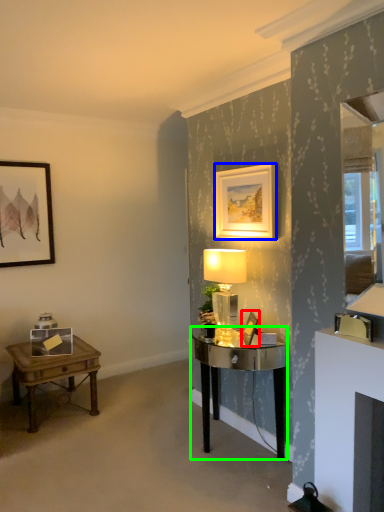
Question: Which object is the farthest from picture frame (highlighted by a red box)? Choose among these: picture frame (highlighted by a blue box) or desk (highlighted by a green box).

Choices:
 (A) picture frame
 (B) desk

Answer: (A)